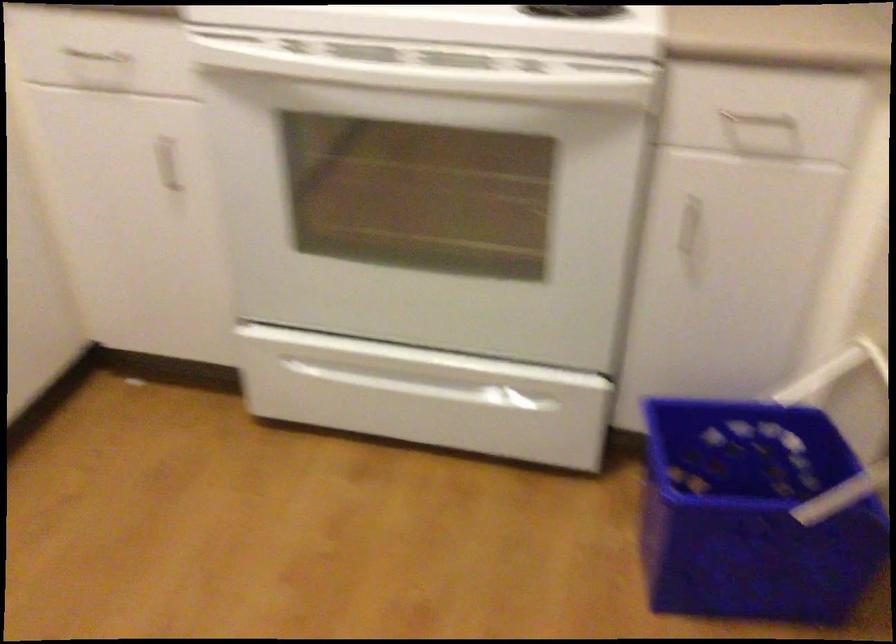
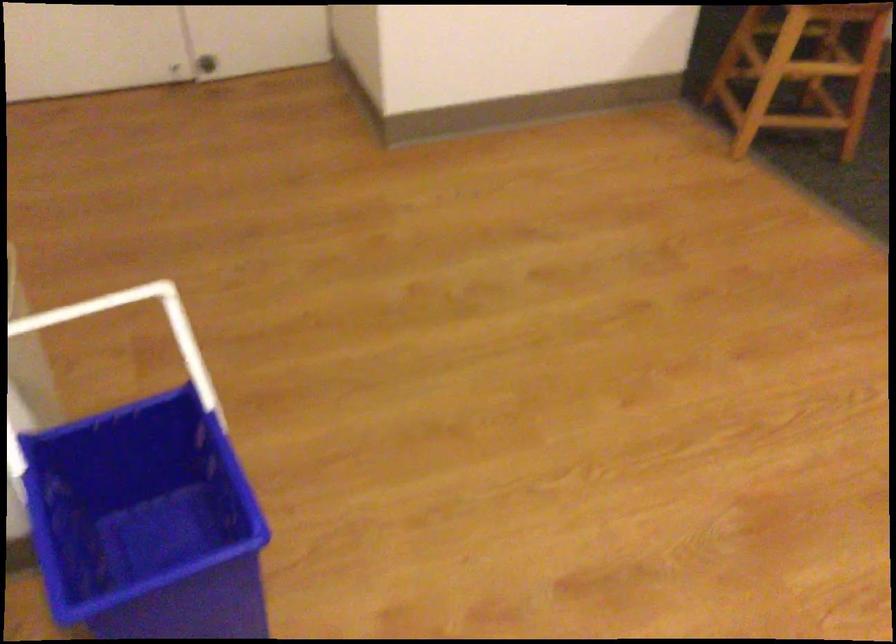
Question: I am providing you with two images of the same scene from different viewpoints. Please identify which objects are invisible in image2.

Choices:
 (A) paper map
 (B) white bin handle
 (C) wooden stool step
 (D) blue plastic bin

Answer: (D)